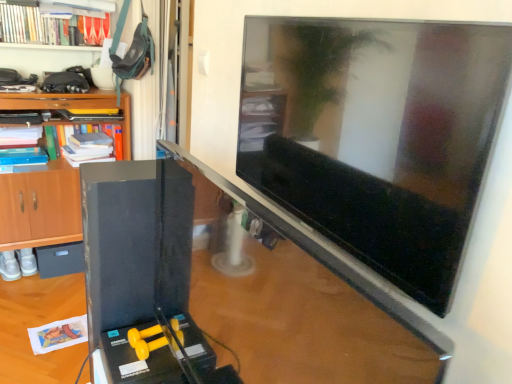
Question: Does green matte book at upper left, which is counted as the 2th book, starting from the top, have a larger size compared to black matte drawer at lower left?

Choices:
 (A) no
 (B) yes

Answer: (B)

Question: Is green matte book at upper left, acting as the 1th book starting from the bottom, facing towards black matte drawer at lower left?

Choices:
 (A) yes
 (B) no

Answer: (B)

Question: Considering the relative sizes of green matte book at upper left, acting as the 1th book starting from the bottom, and black matte drawer at lower left in the image provided, is green matte book at upper left, acting as the 1th book starting from the bottom, shorter than black matte drawer at lower left?

Choices:
 (A) no
 (B) yes

Answer: (A)

Question: Is green matte book at upper left, acting as the 1th book starting from the bottom, wider than black matte drawer at lower left?

Choices:
 (A) no
 (B) yes

Answer: (A)

Question: Is green matte book at upper left, which is counted as the 2th book, starting from the top, completely or partially outside of black matte drawer at lower left?

Choices:
 (A) no
 (B) yes

Answer: (B)

Question: Does green matte book at upper left, acting as the 1th book starting from the bottom, have a smaller size compared to black matte drawer at lower left?

Choices:
 (A) no
 (B) yes

Answer: (A)

Question: Does green matte book at upper left, acting as the 1th book starting from the bottom, have a larger size compared to wooden cabinet at left?

Choices:
 (A) yes
 (B) no

Answer: (B)

Question: From the image's perspective, is green matte book at upper left, which is counted as the 2th book, starting from the top, located beneath wooden cabinet at left?

Choices:
 (A) yes
 (B) no

Answer: (B)

Question: Can you confirm if green matte book at upper left, acting as the 1th book starting from the bottom, is smaller than wooden cabinet at left?

Choices:
 (A) no
 (B) yes

Answer: (B)

Question: Is green matte book at upper left, which is counted as the 2th book, starting from the top, positioned in front of wooden cabinet at left?

Choices:
 (A) yes
 (B) no

Answer: (B)

Question: From a real-world perspective, is green matte book at upper left, acting as the 1th book starting from the bottom, located higher than wooden cabinet at left?

Choices:
 (A) no
 (B) yes

Answer: (B)

Question: From a real-world perspective, is green matte book at upper left, acting as the 1th book starting from the bottom, physically below wooden cabinet at left?

Choices:
 (A) no
 (B) yes

Answer: (A)

Question: Considering the relative sizes of wooden cabinet at left and black matte drawer at lower left in the image provided, is wooden cabinet at left shorter than black matte drawer at lower left?

Choices:
 (A) no
 (B) yes

Answer: (A)